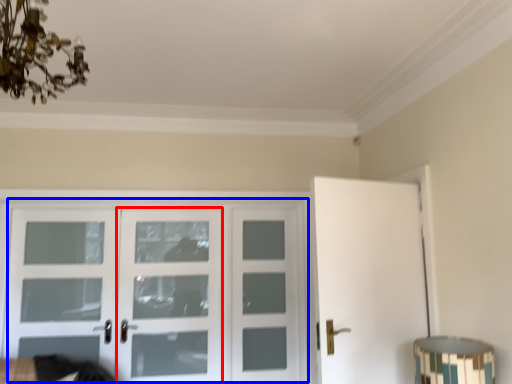
Question: Which object appears closest to the camera in this image, screen door (highlighted by a red box) or door (highlighted by a blue box)?

Choices:
 (A) screen door
 (B) door

Answer: (B)